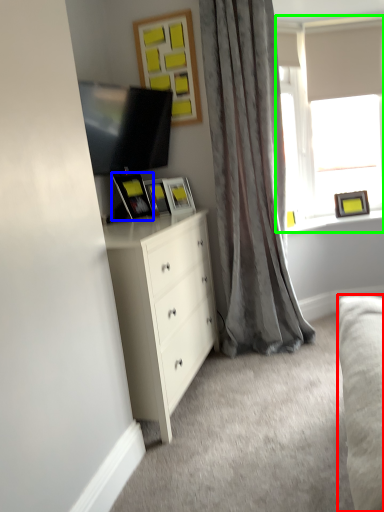
Question: Which object is the farthest from studio couch (highlighted by a red box)? Choose among these: picture frame (highlighted by a blue box) or window (highlighted by a green box).

Choices:
 (A) picture frame
 (B) window

Answer: (B)